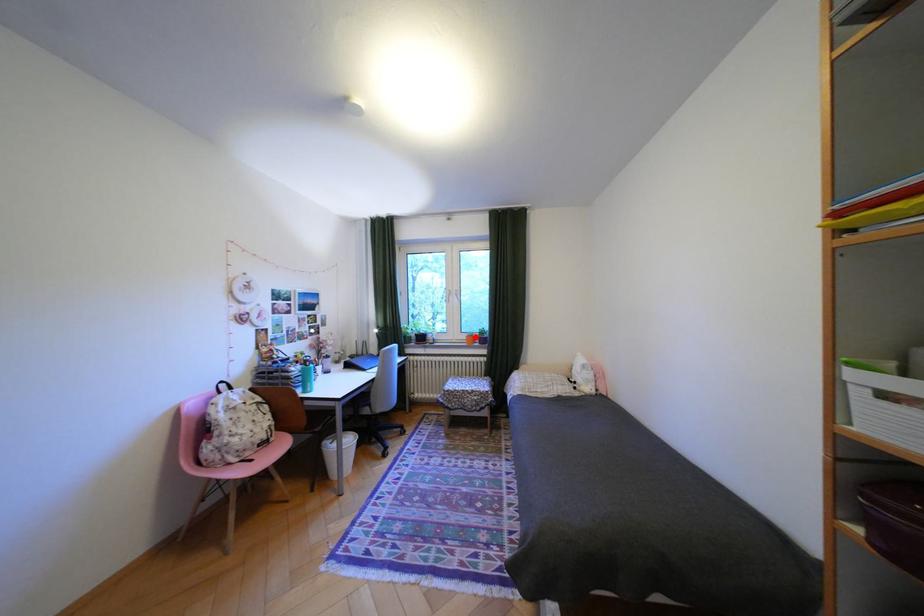
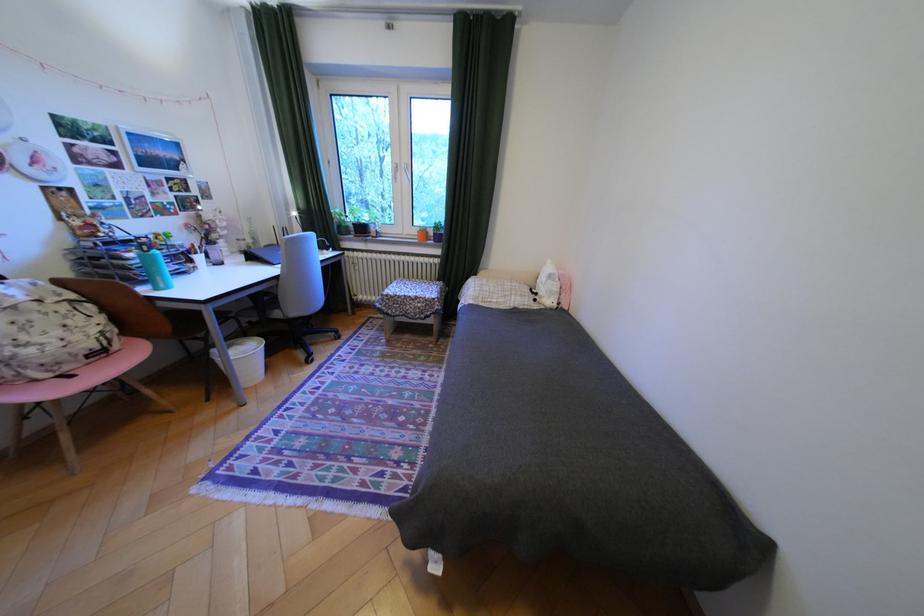
Where in the second image is the point corresponding to the highlighted location from the first image?

(427, 232)